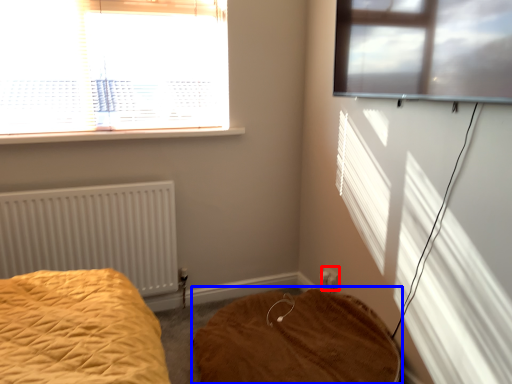
Question: Which point is further to the camera, electric outlet (highlighted by a red box) or mattress (highlighted by a blue box)?

Choices:
 (A) electric outlet
 (B) mattress

Answer: (A)